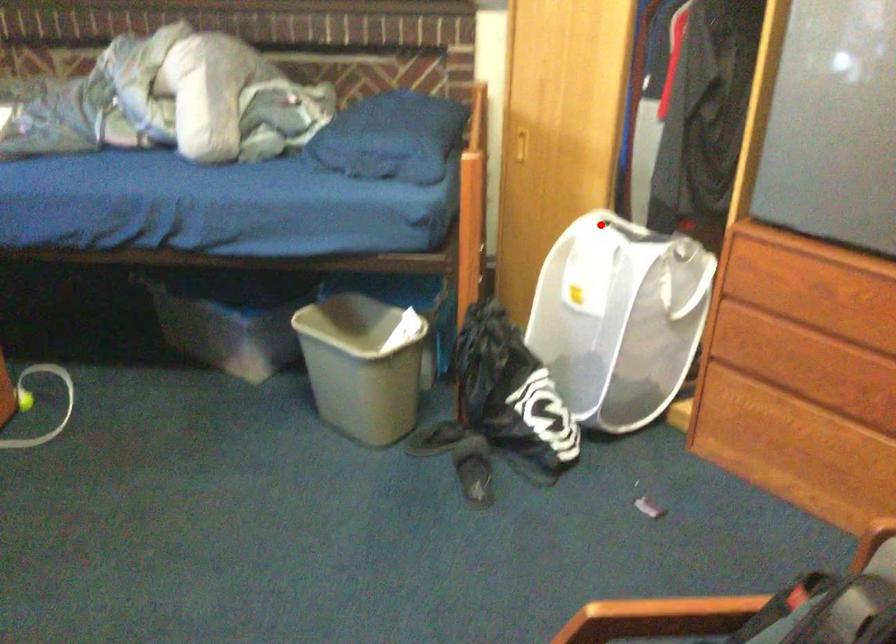
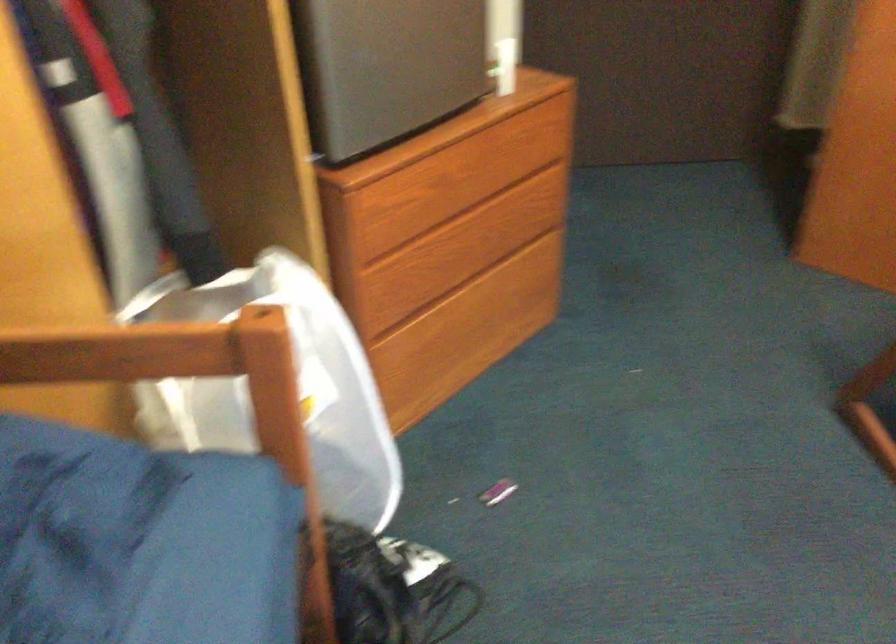
Question: I am providing you with two images of the same scene from different viewpoints. A red point is marked on the first image. Can you still see the location of the red point in image 2?

Choices:
 (A) Yes
 (B) No

Answer: (B)